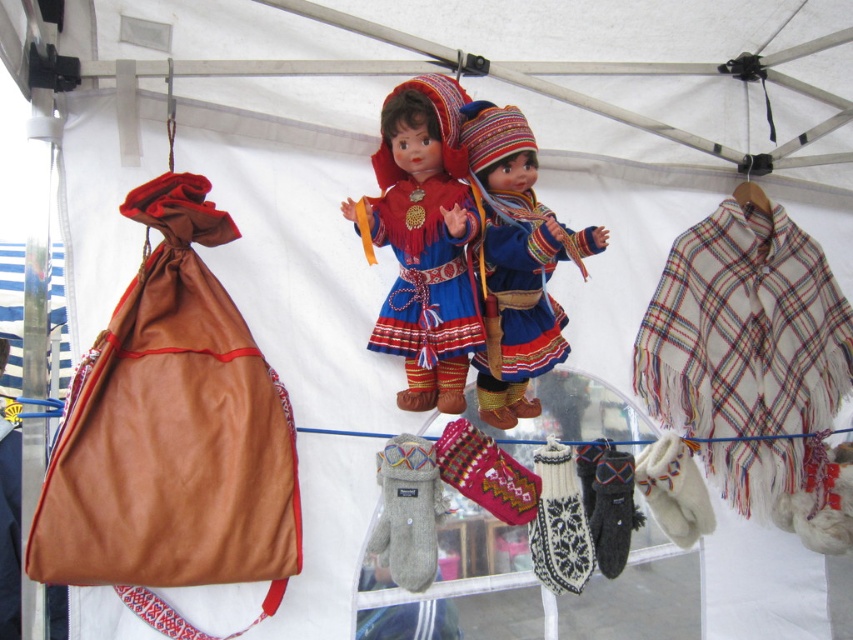
Question: Is white plaid shawl at upper right positioned behind matte blue fabric dress at center?

Choices:
 (A) yes
 (B) no

Answer: (A)

Question: Can you confirm if white plaid shawl at upper right is positioned to the right of matte blue fabric dress at center?

Choices:
 (A) no
 (B) yes

Answer: (B)

Question: Is matte blue fabric dress at center bigger than gray wool mittens at center?

Choices:
 (A) no
 (B) yes

Answer: (B)

Question: Which point appears closest to the camera in this image?

Choices:
 (A) (534, 296)
 (B) (804, 260)
 (C) (410, 461)

Answer: (C)

Question: Which point is farther from the camera taking this photo?

Choices:
 (A) (555, 333)
 (B) (750, 252)
 (C) (393, 548)
 (D) (421, 237)

Answer: (B)

Question: Which point is farther to the camera?

Choices:
 (A) matte blue fabric doll at center
 (B) gray wool mittens at center
 (C) matte blue fabric dress at center

Answer: (B)